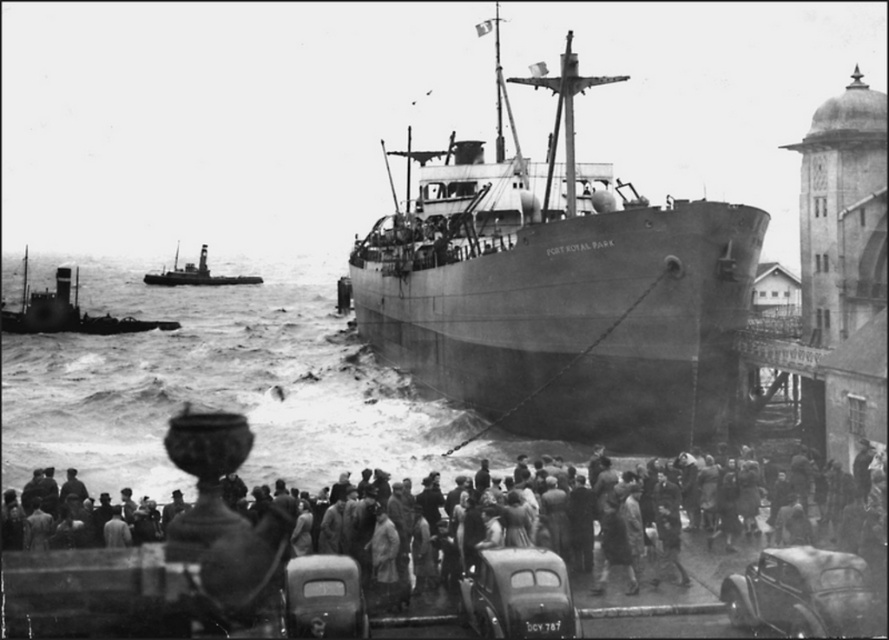
You are a photographer standing at the edge of the dock, aiming to capture a clear photo of the shiny black car at lower right without the smooth gray ship at center obstructing it. Is this possible given their positions?

The shiny black car at lower right is behind the smooth gray ship at center, so it will be obstructed and cannot be photographed clearly without the ship blocking it.

You are a photographer standing at the edge of the dock in the harbor scene. You want to capture a wide shot of the cargo ship Port Royal Park and include both the rough sea water at lower center and the matte black car at lower center in your photo. Which object will occupy more space in your final image?

The rough sea water at lower center will occupy more space in the final image because it is bigger than the matte black car at lower center according to the description.

You are standing at the dock and see two points marked in the image. The first point is at coordinate point(467, 428) and the second is at point(519, 620). If you want to walk from the first point to the second point, which direction should you face to move towards the second point?

To move from point(467, 428) to point(519, 620), you should face towards the right direction since point(519, 620) is to the right of point(467, 428).